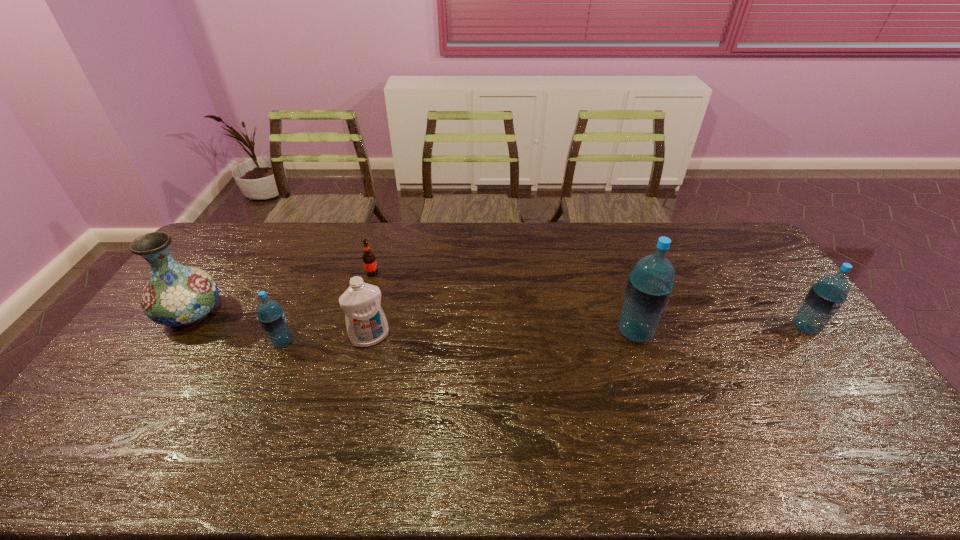
Identify the location of vacant space at the right edge of the desktop. (768, 313).

In the image, there is a desktop. At what (x,y) coordinates should I click in order to perform the action: click on free space at the near left corner. Please return your answer as a coordinate pair (x, y). The width and height of the screenshot is (960, 540). Looking at the image, I should click on (97, 420).

Where is `vacant space at the far right corner of the desktop`? The image size is (960, 540). vacant space at the far right corner of the desktop is located at coordinates (732, 238).

In the image, there is a desktop. In order to click on vacant space at the near right corner in this screenshot , I will do `click(837, 408)`.

The image size is (960, 540). In order to click on free space between the root beer and the shortest water bottle in this screenshot , I will do `click(327, 307)`.

Where is `free space between the shortest water bottle and the vase`? free space between the shortest water bottle and the vase is located at coordinates pyautogui.click(x=237, y=328).

This screenshot has height=540, width=960. Find the location of `free space between the vase and the rightmost object`. free space between the vase and the rightmost object is located at coordinates (498, 321).

The width and height of the screenshot is (960, 540). What are the coordinates of `free space between the leftmost water bottle and the rightmost water bottle` in the screenshot? It's located at (544, 335).

Where is `blank region between the vase and the second tallest water bottle`? The image size is (960, 540). blank region between the vase and the second tallest water bottle is located at coordinates (498, 321).

In order to click on vacant space in between the fifth tallest object and the shortest object in this screenshot , I will do `click(327, 307)`.